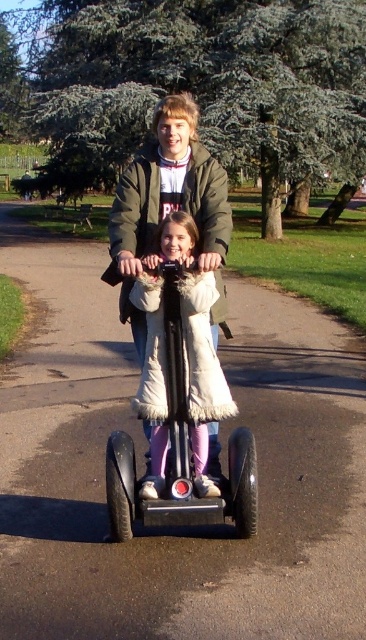
Question: From the image, what is the correct spatial relationship of black rubber segway at center in relation to metallic silver scooter at center?

Choices:
 (A) below
 (B) above

Answer: (B)

Question: Among these points, which one is farthest from the camera?

Choices:
 (A) (117, 616)
 (B) (148, 465)
 (C) (225, 502)

Answer: (B)

Question: Which point appears farthest from the camera in this image?

Choices:
 (A) (42, 259)
 (B) (211, 252)

Answer: (A)

Question: Is black rubber segway at center positioned before matte green jacket at center?

Choices:
 (A) yes
 (B) no

Answer: (A)

Question: Which object is the farthest from the black rubber segway at center?

Choices:
 (A) matte green jacket at center
 (B) metallic silver scooter at center

Answer: (A)

Question: Does black rubber segway at center appear on the right side of matte green jacket at center?

Choices:
 (A) yes
 (B) no

Answer: (A)